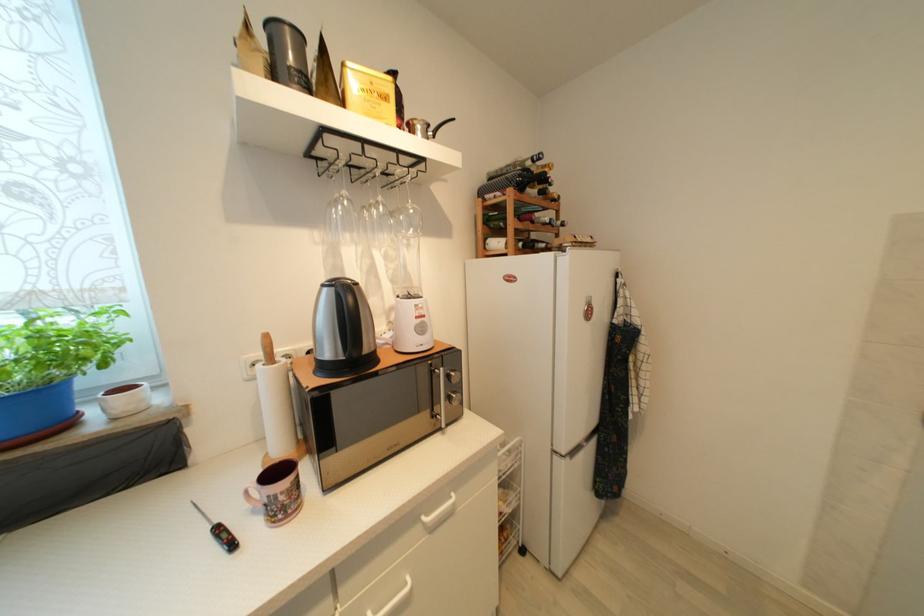
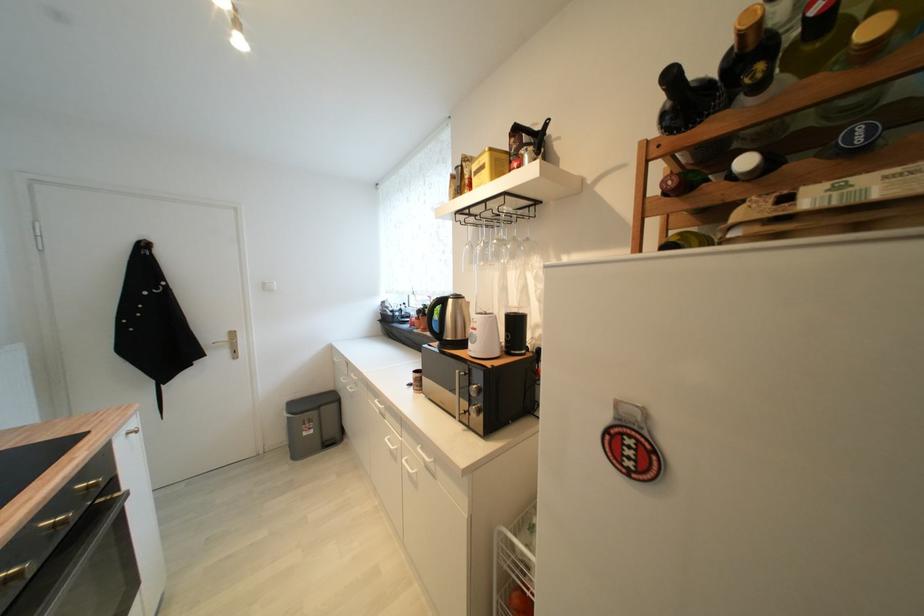
In the second image, find the point that corresponds to pixel 429 318 in the first image.

(480, 331)